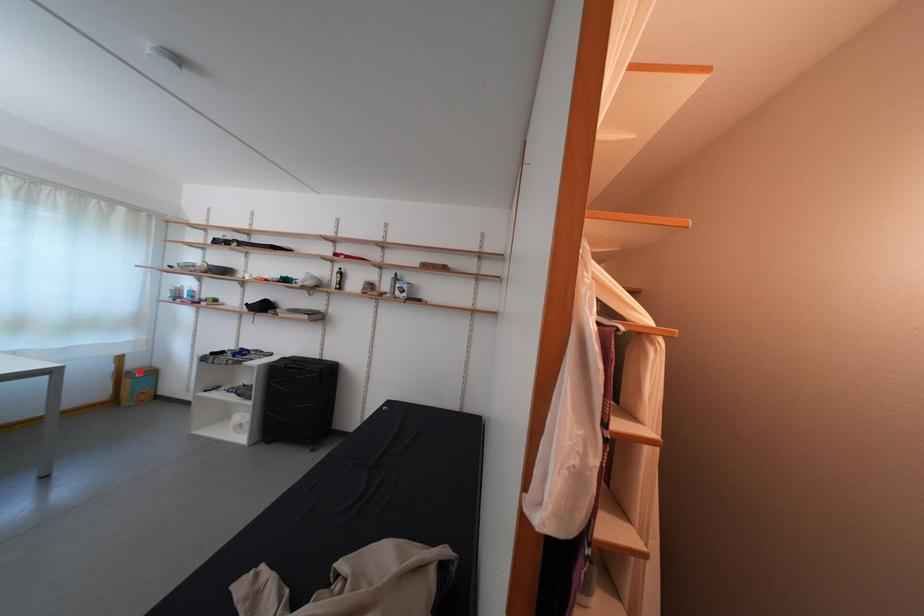
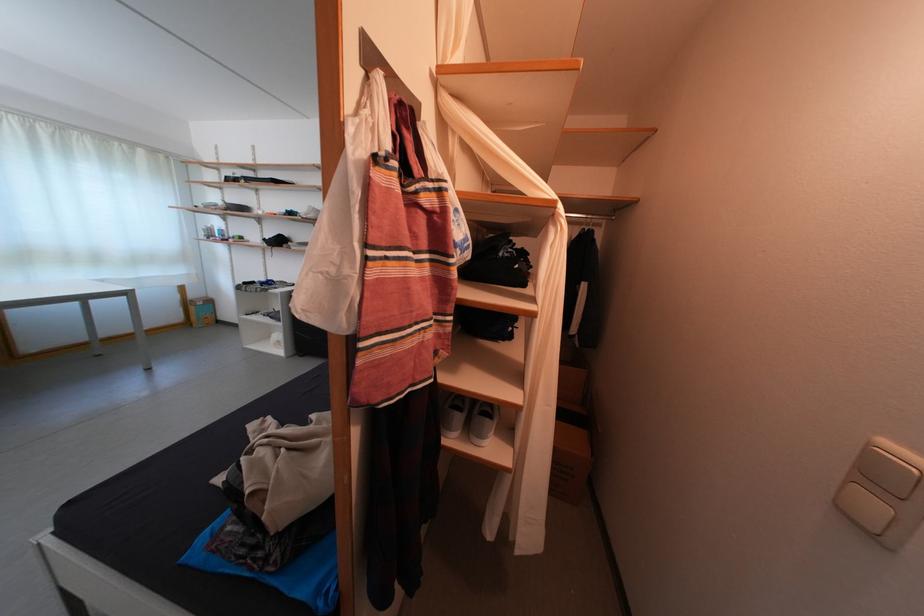
Find the pixel in the second image that matches the highlighted location in the first image.

(201, 302)